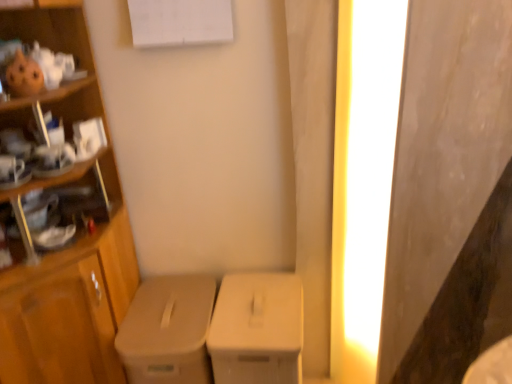
Question: In the image, is white matte cardboard box at center, marked as the 2th cardboard box in a left-to-right arrangement, positioned in front of or behind bright yellow light at right?

Choices:
 (A) behind
 (B) front

Answer: (A)

Question: Is point (224, 307) positioned closer to the camera than point (357, 244)?

Choices:
 (A) farther
 (B) closer

Answer: (B)

Question: Which is farther from the matte beige cardboard box at center, which appears as the first cardboard box when viewed from the left?

Choices:
 (A) wooden cabinet at left
 (B) bright yellow light at right
 (C) white matte cardboard box at center, marked as the 2th cardboard box in a left-to-right arrangement

Answer: (B)

Question: Considering the real-world distances, which object is farthest from the wooden cabinet at left?

Choices:
 (A) bright yellow light at right
 (B) matte beige cardboard box at center, arranged as the second cardboard box when viewed from the right
 (C) white matte cardboard box at center, the 1th cardboard box positioned from the right

Answer: (A)